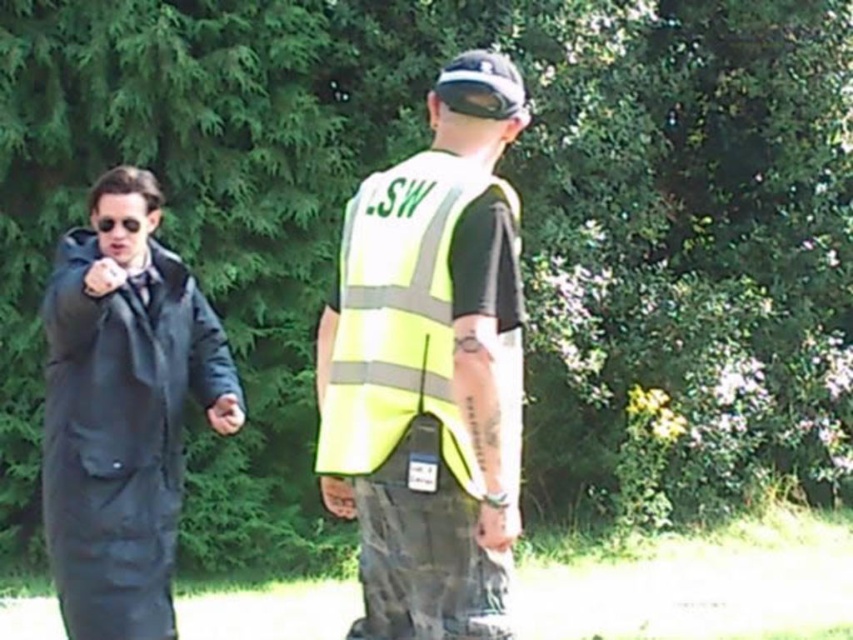
Question: Can you confirm if matte black coat at left is positioned to the right of yellow reflective vest at center?

Choices:
 (A) no
 (B) yes

Answer: (A)

Question: Which point appears farthest from the camera in this image?

Choices:
 (A) (x=125, y=401)
 (B) (x=405, y=260)

Answer: (A)

Question: Which point appears closest to the camera in this image?

Choices:
 (A) (114, 474)
 (B) (340, 333)

Answer: (B)

Question: Does matte black coat at left appear on the left side of yellow reflective vest at center?

Choices:
 (A) no
 (B) yes

Answer: (B)

Question: Does matte black coat at left come in front of yellow reflective vest at center?

Choices:
 (A) no
 (B) yes

Answer: (A)